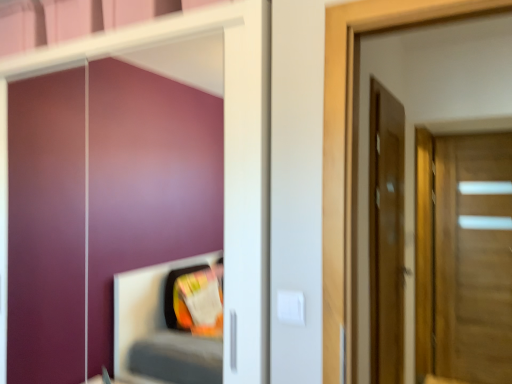
Question: Is point [391, 218] closer or farther from the camera than point [438, 158]?

Choices:
 (A) farther
 (B) closer

Answer: (B)

Question: In terms of width, does matte wooden door at right, placed as the 1th door when sorted from left to right, look wider or thinner when compared to wooden door at right, the 2th door from the front?

Choices:
 (A) wide
 (B) thin

Answer: (B)

Question: From their relative heights in the image, would you say matte wooden door at right, placed as the 1th door when sorted from left to right, is taller or shorter than wooden door at right, the first door from the right?

Choices:
 (A) short
 (B) tall

Answer: (A)

Question: Is wooden door at right, the 2th door from the front, to the left or to the right of matte wooden door at right, the 2th door in the right-to-left sequence, in the image?

Choices:
 (A) left
 (B) right

Answer: (B)

Question: From a real-world perspective, is wooden door at right, the first door from the right, positioned above or below matte wooden door at right, the 2th door in the right-to-left sequence?

Choices:
 (A) above
 (B) below

Answer: (B)

Question: Relative to matte wooden door at right, placed as the 1th door when sorted from left to right, is wooden door at right, the 2th door from the front, in front or behind?

Choices:
 (A) behind
 (B) front

Answer: (A)

Question: In terms of width, does wooden door at right, which is counted as the 2th door, starting from the left, look wider or thinner when compared to matte wooden door at right, placed as the 1th door when sorted from left to right?

Choices:
 (A) wide
 (B) thin

Answer: (A)